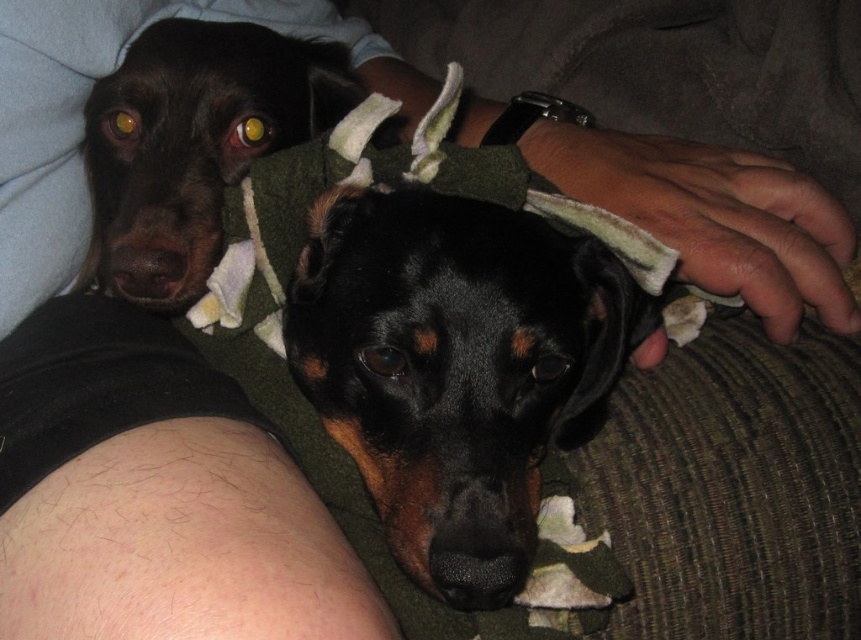
You are a photographer standing at a certain distance from the black matte dog at center. You want to take a closeup photo of it. The camera requires a minimum distance of 18 inches to focus properly. Will you need to move closer or farther away to achieve proper focus?

The distance between the black matte dog at center and the camera is 17.64 inches, which is less than the required 18 inches. Therefore, you need to move slightly farther away to achieve proper focus.

You are a dog trainer observing the scene. You need to locate the black matte dog at center. What are its coordinates?

The black matte dog at center is located at coordinates point (456,368).

You are a photographer trying to capture a closeup of the dog wearing a green sweater with white trim. You notice two points marked in the image at coordinates point [546,412] and point [150,134]. Which point should you focus on to ensure the dog in the foreground is sharply captured?

Point [546,412] is in front of point [150,134], so focusing on point [546,412] will ensure the dog in the foreground is sharply captured.